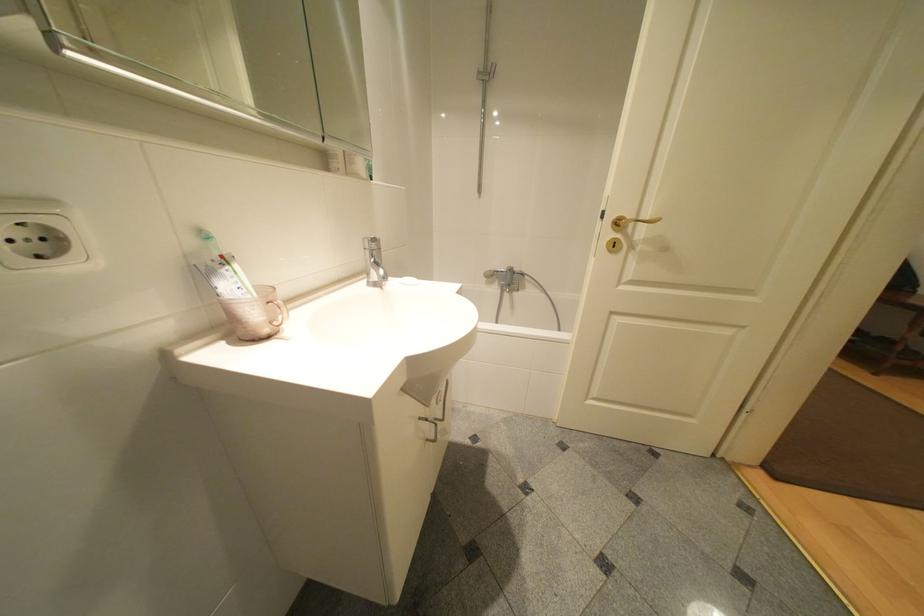
Where would you turn the silver faucet handle? Please return your answer as a coordinate pair (x, y).

(371, 241)